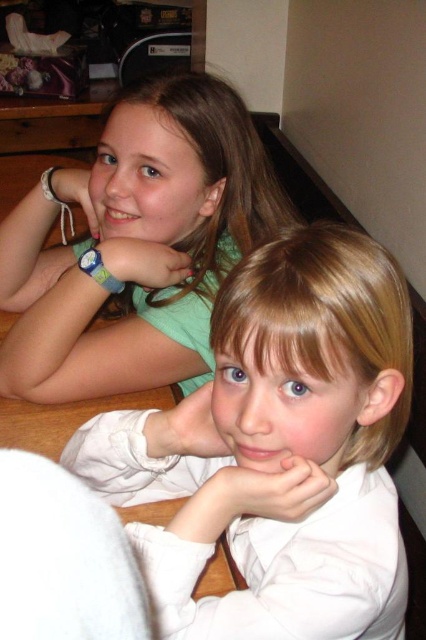
Question: Among these objects, which one is nearest to the camera?

Choices:
 (A) green matte shirt at upper left
 (B) white smooth shirt at center

Answer: (B)

Question: Which of the following is the closest to the observer?

Choices:
 (A) white smooth shirt at center
 (B) green matte shirt at upper left

Answer: (A)

Question: Is white smooth shirt at center below green matte shirt at upper left?

Choices:
 (A) yes
 (B) no

Answer: (A)

Question: Does white smooth shirt at center appear under green matte shirt at upper left?

Choices:
 (A) no
 (B) yes

Answer: (B)

Question: Can you confirm if white smooth shirt at center is wider than green matte shirt at upper left?

Choices:
 (A) no
 (B) yes

Answer: (A)